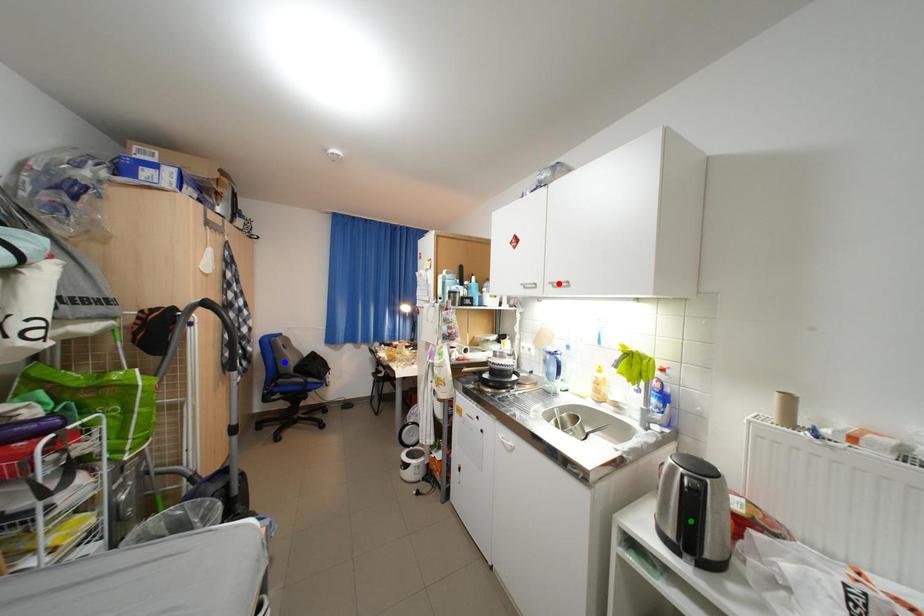
Order these from nearest to farthest:
A) blue point
B) red point
C) green point

green point → red point → blue point